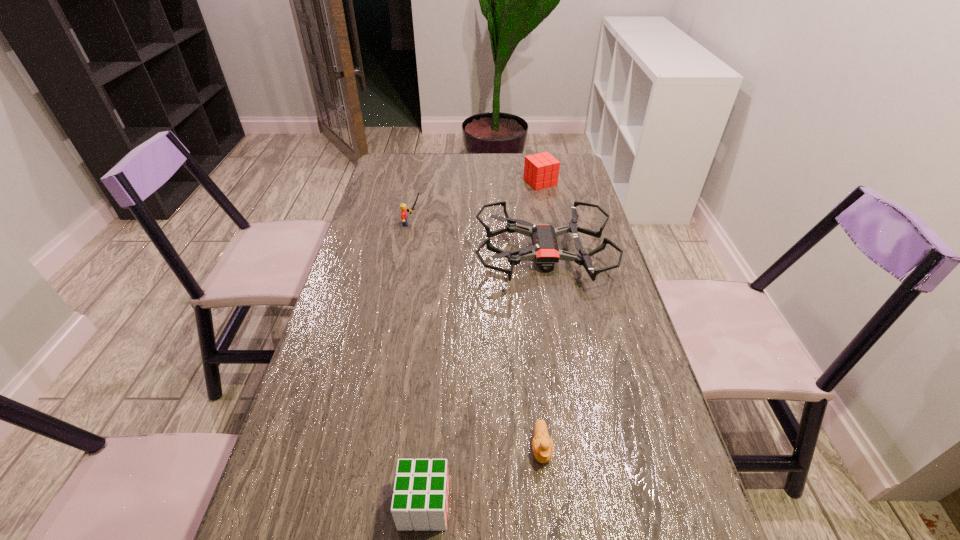
Find the location of a particular element. vacant space at the far edge is located at coordinates [495, 170].

Identify the location of vacant area at the left edge. This screenshot has height=540, width=960. (325, 382).

Find the location of a particular element. This screenshot has width=960, height=540. free region at the right edge of the desktop is located at coordinates (616, 402).

The image size is (960, 540). In order to click on free space that is in between the drone and the farther cube in this screenshot , I will do `click(541, 219)`.

The image size is (960, 540). I want to click on free space between the leftmost object and the fourth object from right to left, so click(419, 364).

The height and width of the screenshot is (540, 960). In order to click on unoccupied area between the farthest object and the nearer cube in this screenshot , I will do (482, 343).

The height and width of the screenshot is (540, 960). In order to click on free spot between the drone and the right cube in this screenshot , I will do `click(541, 219)`.

This screenshot has height=540, width=960. I want to click on vacant area that lies between the duckling and the leftmost object, so click(x=477, y=336).

In order to click on vacant area between the drone and the left cube in this screenshot , I will do `click(484, 380)`.

Identify the location of empty location between the farther cube and the duckling. This screenshot has width=960, height=540. (540, 315).